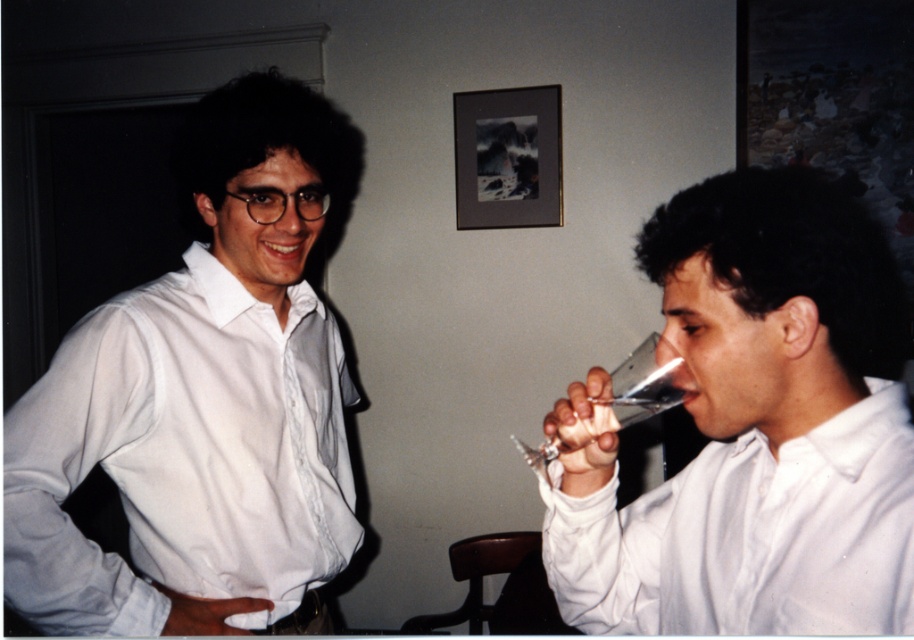
Question: Which point appears closest to the camera in this image?

Choices:
 (A) (826, 412)
 (B) (200, 292)

Answer: (A)

Question: Is the position of clear glass at right more distant than that of clear glass wine glass at right?

Choices:
 (A) yes
 (B) no

Answer: (B)

Question: Does white glossy shirt at left have a lesser width compared to clear glass at right?

Choices:
 (A) yes
 (B) no

Answer: (A)

Question: Among these points, which one is farthest from the camera?

Choices:
 (A) (657, 401)
 (B) (878, 275)
 (C) (146, 508)

Answer: (C)

Question: Estimate the real-world distances between objects in this image. Which object is closer to the clear glass at right?

Choices:
 (A) white glossy shirt at left
 (B) clear glass wine glass at right

Answer: (B)

Question: Does white glossy shirt at left appear on the left side of clear glass at right?

Choices:
 (A) no
 (B) yes

Answer: (B)